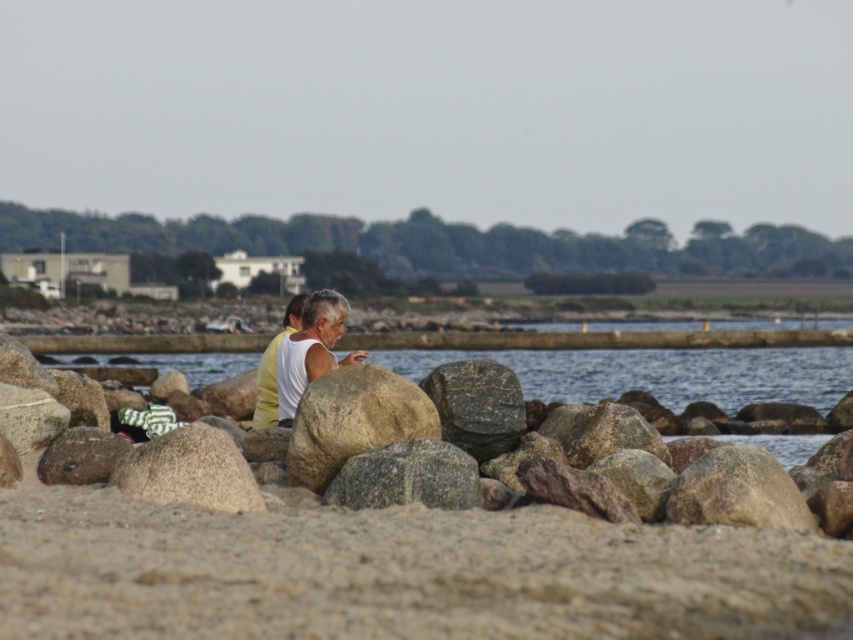
You are standing on the beach and want to walk towards the water without getting your feet wet. Which direction should you move relative to the smooth beige sand at lower center and the clear water at center?

You should move towards the smooth beige sand at lower center, which is in front of the clear water at center, so walking towards the sand will keep your feet dry before reaching the water.

You are standing at the edge of the beach and want to place a small bucket on the sand. According to the coordinates provided, where should you place it to ensure it stays on the smooth beige sand at lower center?

Place the bucket at point (x=399, y=573) to ensure it stays on the smooth beige sand at lower center.